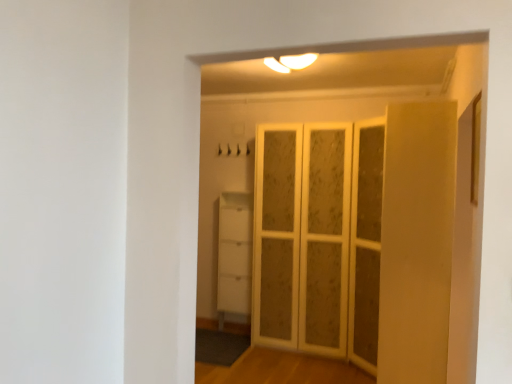
What do you see at coordinates (234, 253) in the screenshot? Image resolution: width=512 pixels, height=384 pixels. I see `white matte cabinet at lower center` at bounding box center [234, 253].

This screenshot has width=512, height=384. In order to click on white matte cabinet at lower center in this screenshot , I will do `click(234, 253)`.

In order to click on white textured screen door at center in this screenshot , I will do `click(303, 237)`.

What do you see at coordinates (303, 237) in the screenshot? The height and width of the screenshot is (384, 512). I see `white textured screen door at center` at bounding box center [303, 237].

This screenshot has height=384, width=512. I want to click on white matte cabinet at lower center, so click(234, 253).

Between white textured screen door at center and white matte cabinet at lower center, which one appears on the right side from the viewer's perspective?

white textured screen door at center.

Does white textured screen door at center come behind white matte cabinet at lower center?

No, it is not.

Which is less distant, [336,183] or [231,264]?

The point [336,183] is closer to the camera.

From the image's perspective, is white textured screen door at center above or below white matte cabinet at lower center?

white textured screen door at center is above white matte cabinet at lower center.

From a real-world perspective, is white textured screen door at center physically located above or below white matte cabinet at lower center?

Clearly, from a real-world perspective, white textured screen door at center is above white matte cabinet at lower center.

In terms of width, does white textured screen door at center look wider or thinner when compared to white matte cabinet at lower center?

white textured screen door at center is wider than white matte cabinet at lower center.

Can you confirm if white textured screen door at center is taller than white matte cabinet at lower center?

Yes.

Looking at this image, is white textured screen door at center smaller than white matte cabinet at lower center?

No, white textured screen door at center is not smaller than white matte cabinet at lower center.

Is white textured screen door at center outside of white matte cabinet at lower center?

Yes, white textured screen door at center is outside of white matte cabinet at lower center.

Is white textured screen door at center not near white matte cabinet at lower center?

Actually, white textured screen door at center and white matte cabinet at lower center are a little close together.

Is white matte cabinet at lower center at the back of white textured screen door at center?

That's not correct — white textured screen door at center is not looking away from white matte cabinet at lower center.

How many degrees apart are the facing directions of white textured screen door at center and white matte cabinet at lower center?

They differ by 0.406 degrees in their facing directions.

Find the location of a particular element. This screenshot has width=512, height=384. cupboard below the white textured screen door at center (from a real-world perspective) is located at coordinates (234, 253).

Visually, is white matte cabinet at lower center positioned to the left or to the right of white textured screen door at center?

white matte cabinet at lower center is to the left of white textured screen door at center.

Considering the relative positions of white matte cabinet at lower center and white textured screen door at center in the image provided, is white matte cabinet at lower center behind white textured screen door at center?

Yes, it is behind white textured screen door at center.

Does point (234, 232) come closer to viewer compared to point (305, 343)?

No, (234, 232) is behind (305, 343).

From the image's perspective, would you say white matte cabinet at lower center is shown under white textured screen door at center?

Yes.

From a real-world perspective, is white matte cabinet at lower center physically located above or below white textured screen door at center?

In terms of real-world spatial position, white matte cabinet at lower center is below white textured screen door at center.

Which of these two, white matte cabinet at lower center or white textured screen door at center, is wider?

With larger width is white textured screen door at center.

Between white matte cabinet at lower center and white textured screen door at center, which one has less height?

white matte cabinet at lower center is shorter.

Can you confirm if white matte cabinet at lower center is smaller than white textured screen door at center?

Yes.

Can we say white matte cabinet at lower center lies outside white textured screen door at center?

Yes, white matte cabinet at lower center is not within white textured screen door at center.

Are white matte cabinet at lower center and white textured screen door at center located far from each other?

white matte cabinet at lower center is actually quite close to white textured screen door at center.

Is white textured screen door at center at the back of white matte cabinet at lower center?

That's not correct — white matte cabinet at lower center is not looking away from white textured screen door at center.

Identify the location of cupboard on the left side of white textured screen door at center. Image resolution: width=512 pixels, height=384 pixels. (234, 253).

Identify the location of screen door on the right side of white matte cabinet at lower center. (303, 237).

Locate an element on the screen. The image size is (512, 384). cupboard below the white textured screen door at center (from the image's perspective) is located at coordinates (234, 253).